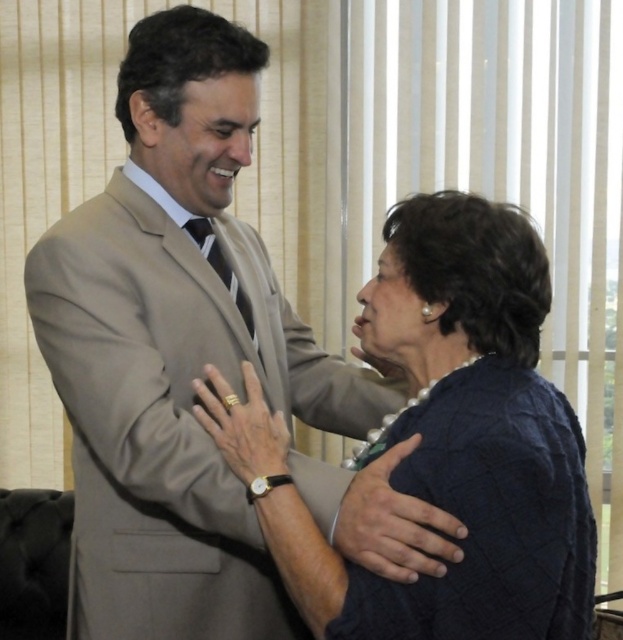
Question: Does light brown suit at center have a lesser width compared to dark blue textured sweater at center?

Choices:
 (A) yes
 (B) no

Answer: (B)

Question: Which point is closer to the camera taking this photo?

Choices:
 (A) (201, 552)
 (B) (411, 243)

Answer: (B)

Question: Is light brown suit at center smaller than dark blue textured sweater at center?

Choices:
 (A) no
 (B) yes

Answer: (A)

Question: Which object is farther from the camera taking this photo?

Choices:
 (A) light brown suit at center
 (B) dark blue textured sweater at center

Answer: (A)

Question: Does light brown suit at center have a lesser width compared to dark blue textured sweater at center?

Choices:
 (A) yes
 (B) no

Answer: (B)